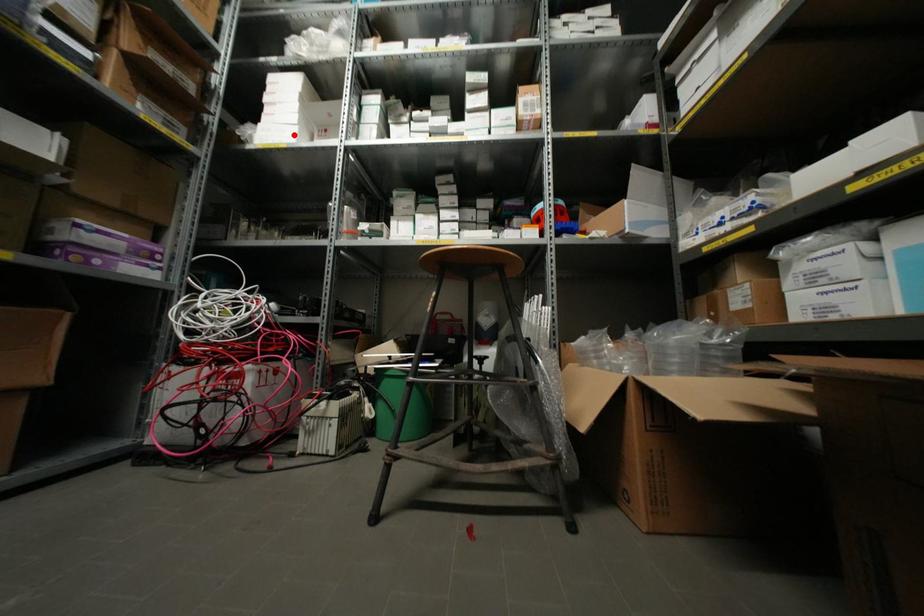
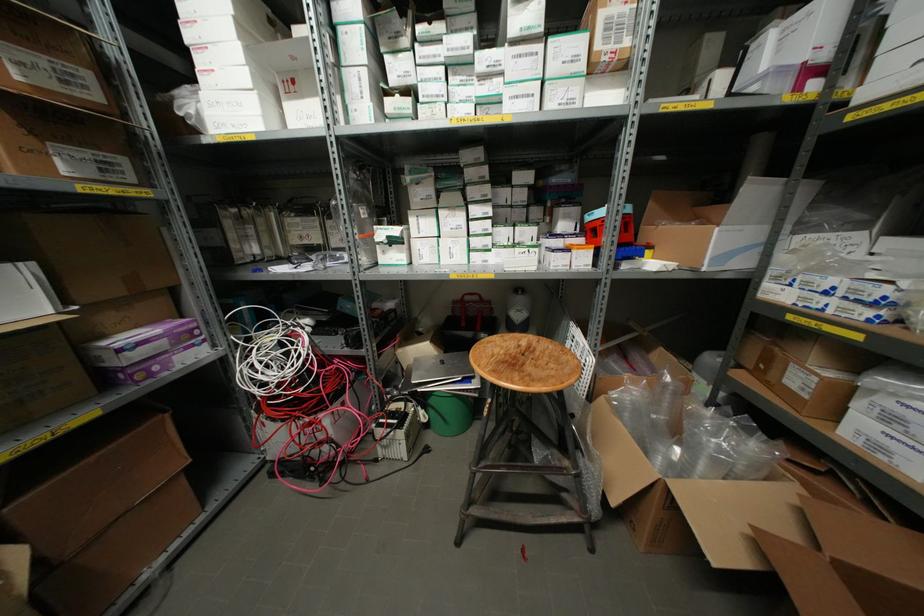
Locate, in the second image, the point that corresponds to the highlighted location in the first image.

(257, 111)